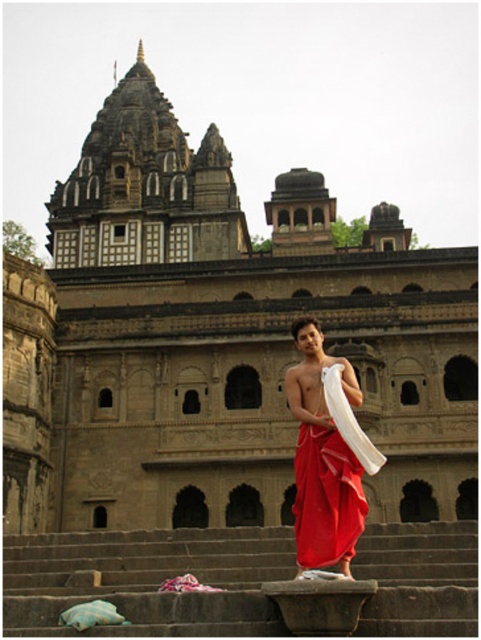
Question: Which point appears farthest from the camera in this image?

Choices:
 (A) (303, 408)
 (B) (173, 116)
 (C) (253, 544)

Answer: (B)

Question: Which object is the farthest from the dark gray stone hindu temple at upper center?

Choices:
 (A) red silk dhoti at center
 (B) smooth stone steps at lower center

Answer: (B)

Question: Can you confirm if smooth stone steps at lower center is bigger than dark gray stone hindu temple at upper center?

Choices:
 (A) no
 (B) yes

Answer: (A)

Question: Is smooth stone steps at lower center thinner than red silk dhoti at center?

Choices:
 (A) no
 (B) yes

Answer: (A)

Question: Estimate the real-world distances between objects in this image. Which object is farther from the dark gray stone hindu temple at upper center?

Choices:
 (A) red silk dhoti at center
 (B) smooth stone steps at lower center

Answer: (B)

Question: Does dark gray stone hindu temple at upper center come behind red silk dhoti at center?

Choices:
 (A) no
 (B) yes

Answer: (B)